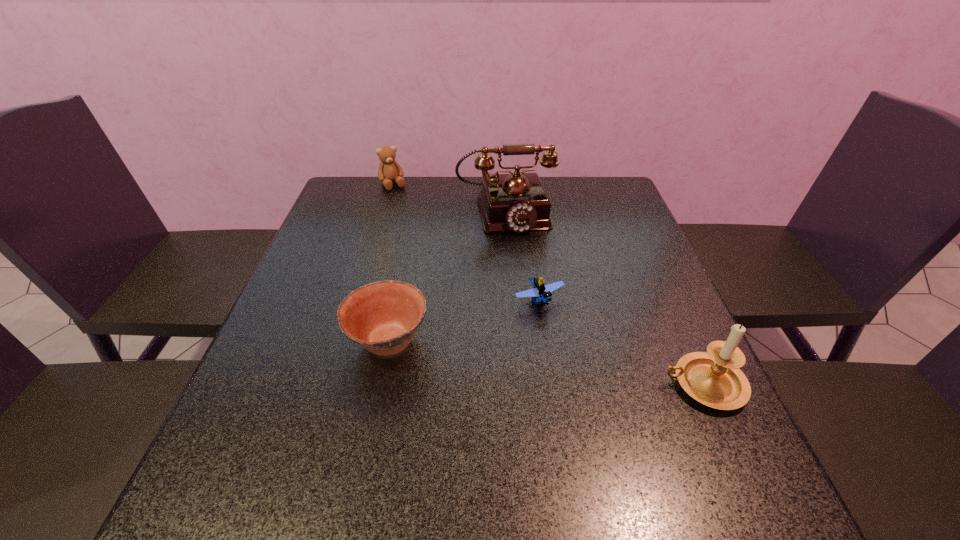
This screenshot has width=960, height=540. I want to click on teddy bear that is at the far edge, so click(389, 170).

The image size is (960, 540). Find the location of `object located at the near edge`. object located at the near edge is located at coordinates (713, 378).

I want to click on object that is at the left edge, so click(x=389, y=170).

Locate an element on the screen. This screenshot has height=540, width=960. object that is at the right edge is located at coordinates (713, 378).

You are a GUI agent. You are given a task and a screenshot of the screen. Output one action in this format:
    pyautogui.click(x=<x>, y=<y>)
    Task: Click on the object at the far left corner
    
    Given the screenshot: What is the action you would take?
    pyautogui.click(x=389, y=170)

Find the location of `object present at the near right corner`. object present at the near right corner is located at coordinates 713,378.

Identify the location of vacant space at the far edge of the desktop. (398, 192).

This screenshot has height=540, width=960. I want to click on vacant space at the near edge of the desktop, so click(626, 439).

This screenshot has height=540, width=960. In the image, there is a desktop. Find the location of `vacant area at the left edge`. vacant area at the left edge is located at coordinates 271,393.

In order to click on vacant space at the right edge in this screenshot , I will do `click(602, 245)`.